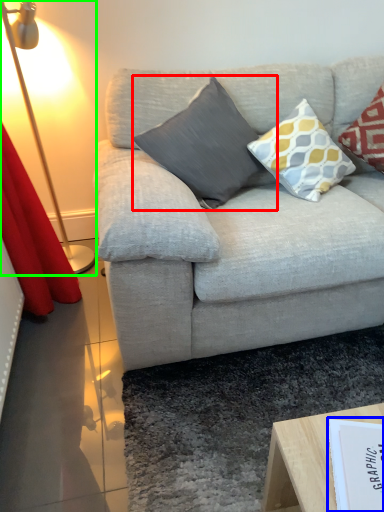
Question: Which object is the farthest from pillow (highlighted by a red box)? Choose among these: paperback book (highlighted by a blue box) or table lamp (highlighted by a green box).

Choices:
 (A) paperback book
 (B) table lamp

Answer: (A)